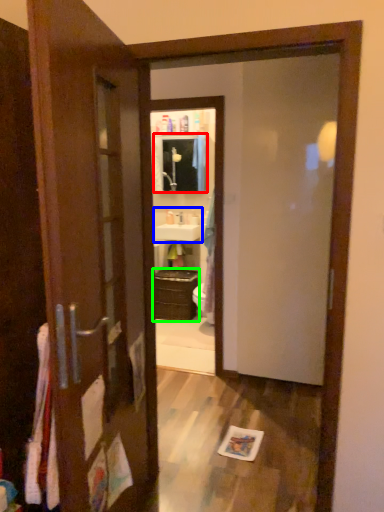
Question: Based on their relative distances, which object is farther from medicine cabinet (highlighted by a red box)? Choose from sink (highlighted by a blue box) and cabinetry (highlighted by a green box).

Choices:
 (A) sink
 (B) cabinetry

Answer: (B)